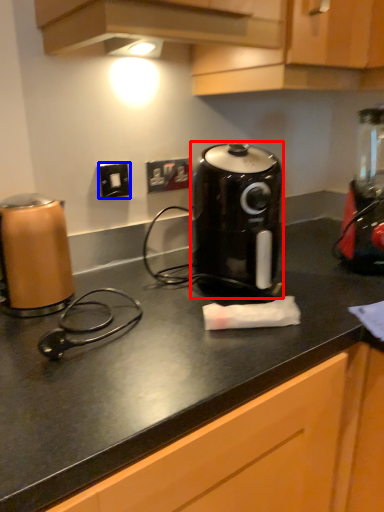
Question: Which point is closer to the camera, kitchen appliance (highlighted by a red box) or electric outlet (highlighted by a blue box)?

Choices:
 (A) kitchen appliance
 (B) electric outlet

Answer: (A)